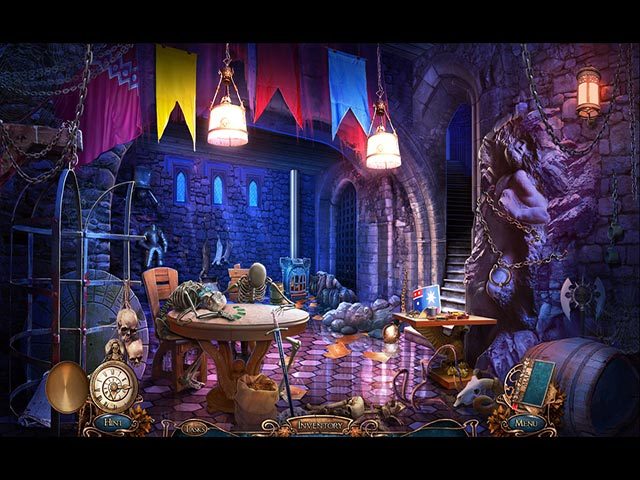
Where is `windows`? windows is located at coordinates (182, 182), (220, 191), (252, 190).